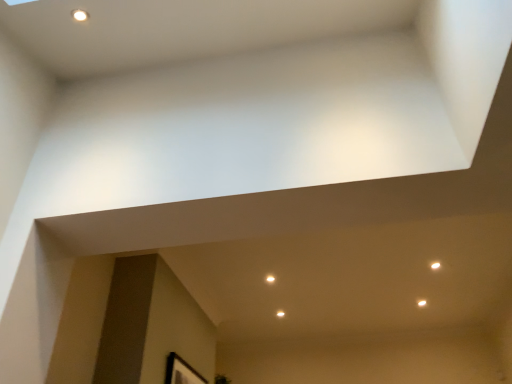
Question: Considering their positions, is white glossy light at center located in front of or behind black matte picture frame at lower right?

Choices:
 (A) front
 (B) behind

Answer: (B)

Question: Looking at their shapes, would you say white glossy light at center is wider or thinner than black matte picture frame at lower right?

Choices:
 (A) thin
 (B) wide

Answer: (B)

Question: From the image's perspective, relative to black matte picture frame at lower right, is white glossy light at center above or below?

Choices:
 (A) below
 (B) above

Answer: (B)

Question: From the image's perspective, is black matte picture frame at lower right positioned above or below white glossy light at center?

Choices:
 (A) above
 (B) below

Answer: (B)

Question: In terms of height, does black matte picture frame at lower right look taller or shorter compared to white glossy light at center?

Choices:
 (A) short
 (B) tall

Answer: (B)

Question: Looking at their shapes, would you say black matte picture frame at lower right is wider or thinner than white glossy light at center?

Choices:
 (A) thin
 (B) wide

Answer: (A)

Question: Relative to white glossy light at center, is black matte picture frame at lower right in front or behind?

Choices:
 (A) behind
 (B) front

Answer: (B)